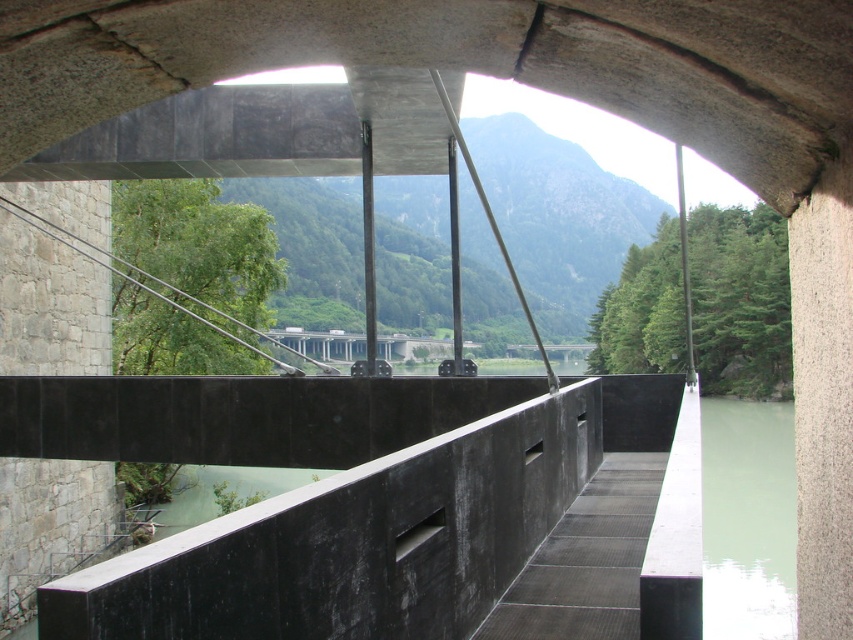
Is greenish concrete river at right positioned in front of green concrete river at lower center?

Yes, it is in front of green concrete river at lower center.

Does greenish concrete river at right appear over green concrete river at lower center?

Yes, greenish concrete river at right is above green concrete river at lower center.

Which is in front, point (781, 440) or point (186, 522)?

Positioned in front is point (186, 522).

I want to click on greenish concrete river at right, so coord(747,518).